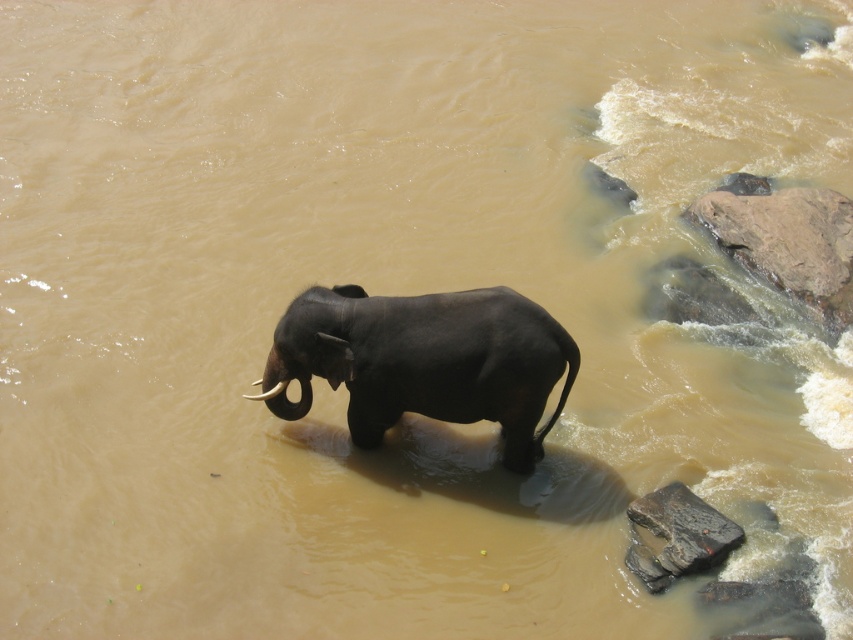
Question: Can you confirm if dark gray stone at lower right is positioned to the right of white ivory tusk at upper center?

Choices:
 (A) yes
 (B) no

Answer: (A)

Question: Which is farther from the dark gray stone at lower right?

Choices:
 (A) shiny black elephant at center
 (B) white ivory tusk at upper center
 (C) white ivory tusk at center

Answer: (B)

Question: Is shiny black elephant at center smaller than white ivory tusk at center?

Choices:
 (A) yes
 (B) no

Answer: (B)

Question: Which object is the farthest from the white ivory tusk at center?

Choices:
 (A) dark gray stone at lower right
 (B) shiny black elephant at center
 (C) white ivory tusk at upper center

Answer: (A)

Question: Does shiny black elephant at center appear over white ivory tusk at upper center?

Choices:
 (A) no
 (B) yes

Answer: (B)

Question: Which point is farther to the camera?

Choices:
 (A) (263, 400)
 (B) (258, 381)

Answer: (B)